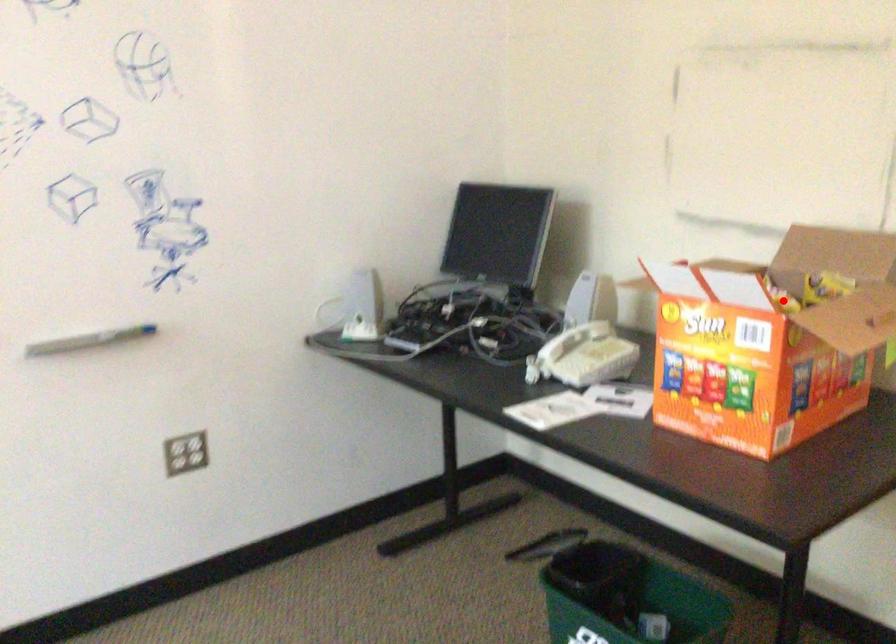
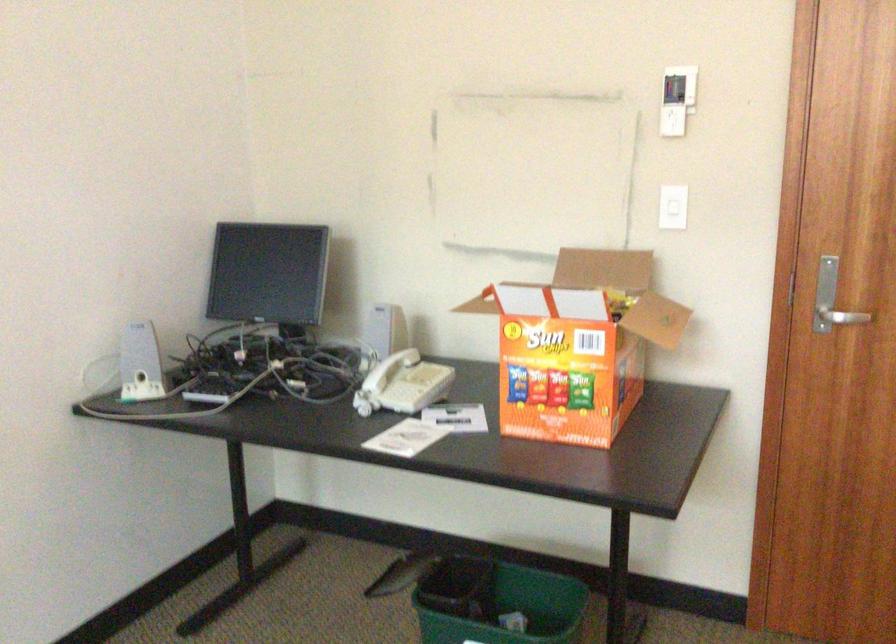
Question: I am providing you with two images of the same scene from different viewpoints. A red point is marked on the first image. Is the red point's position out of view in image 2?

Choices:
 (A) Yes
 (B) No

Answer: (A)